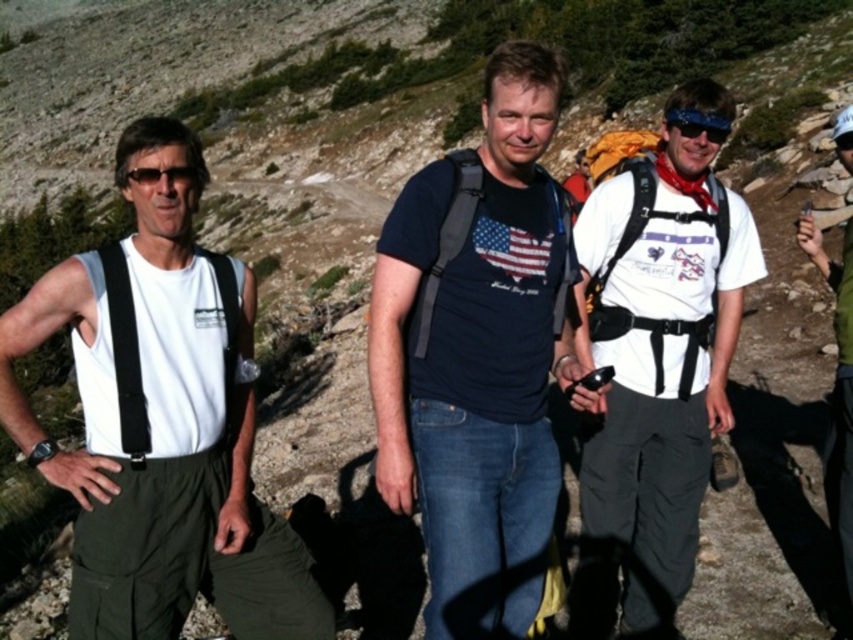
From the picture: You are planning to take a photo of the scene. The matte black backpack at center and the blue reflective lens sunglasses at upper right are in your frame. To avoid glare from the sun, which object should you position away from the light source?

The blue reflective lens sunglasses at upper right should be positioned away from the light source because they have reflective surfaces that could cause glare, while the matte black backpack at center has a nonreflective surface.